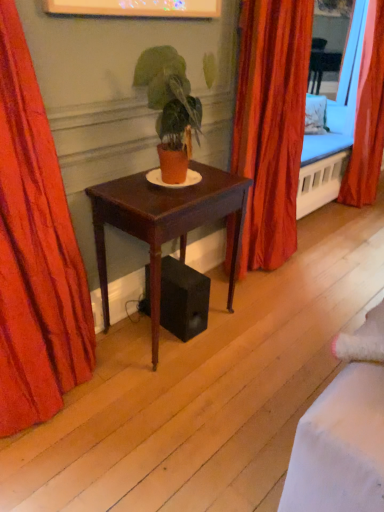
You are a GUI agent. You are given a task and a screenshot of the screen. Output one action in this format:
    pyautogui.click(x=<x>, y=<y>)
    Task: Click on the vacant area that is situated to the right of mahogany wood desk at center
    
    Given the screenshot: What is the action you would take?
    pyautogui.click(x=259, y=332)